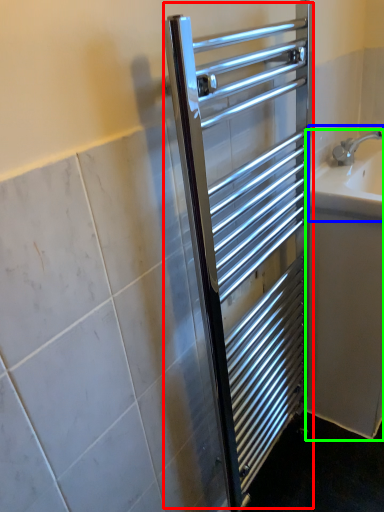
Question: Based on their relative distances, which object is farther from screen door (highlighted by a red box)? Choose from sink (highlighted by a blue box) and bath (highlighted by a green box).

Choices:
 (A) sink
 (B) bath

Answer: (A)